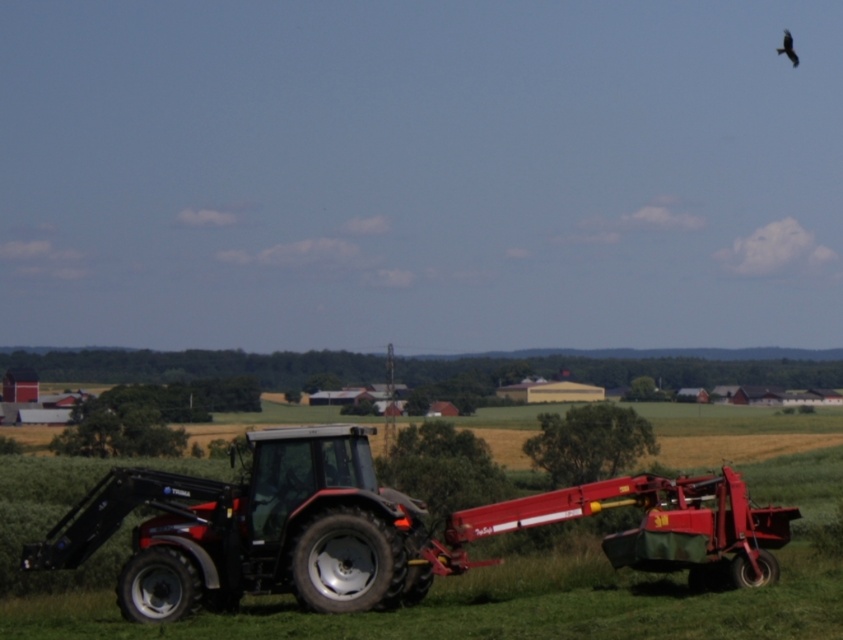
Question: Which point is closer to the camera?

Choices:
 (A) matte black tractor at center
 (B) black feathered bird at upper right

Answer: (A)

Question: Is matte black tractor at center positioned in front of black feathered bird at upper right?

Choices:
 (A) no
 (B) yes

Answer: (B)

Question: Considering the relative positions of matte black tractor at center and black feathered bird at upper right in the image provided, where is matte black tractor at center located with respect to black feathered bird at upper right?

Choices:
 (A) left
 (B) right

Answer: (A)

Question: Is matte black tractor at center closer to camera compared to black feathered bird at upper right?

Choices:
 (A) no
 (B) yes

Answer: (B)

Question: Which of the following is the farthest from the observer?

Choices:
 (A) black feathered bird at upper right
 (B) matte black tractor at center

Answer: (A)